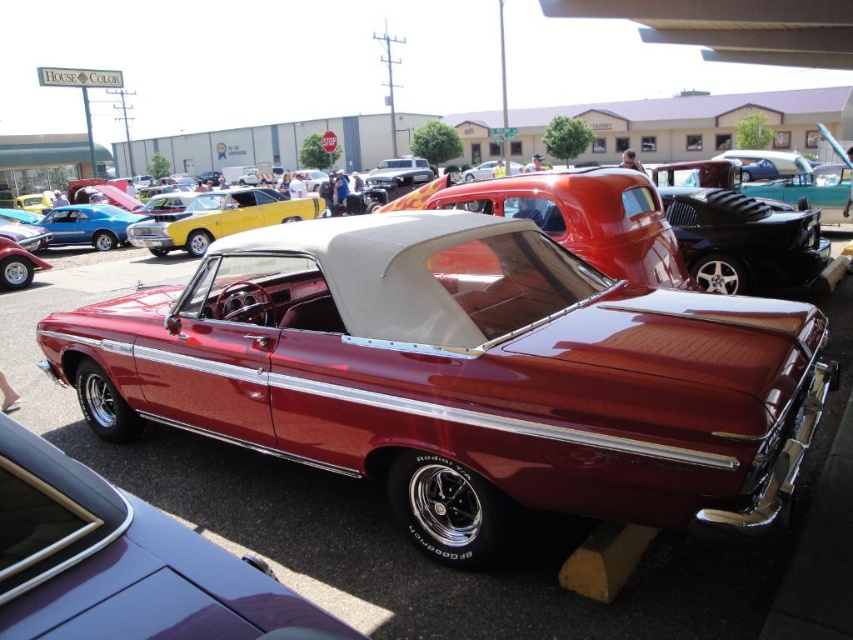
Who is positioned more to the left, shiny red car at center or shiny chrome car at center?

shiny chrome car at center

From the picture: Can you confirm if shiny red car at center is positioned to the left of shiny chrome car at center?

No, shiny red car at center is not to the left of shiny chrome car at center.

I want to click on shiny red car at center, so click(x=462, y=376).

Does shiny metallic yellow car at center have a lesser width compared to shiny chrome car at center?

Correct, shiny metallic yellow car at center's width is less than shiny chrome car at center's.

Who is shorter, shiny metallic yellow car at center or shiny chrome car at center?

shiny metallic yellow car at center is shorter.

This screenshot has height=640, width=853. Find the location of `shiny metallic yellow car at center`. shiny metallic yellow car at center is located at coordinates (219, 218).

Looking at this image, does shiny red car at center lie in front of shiny metallic yellow car at center?

Yes, it is.

Does point (695, 467) lie in front of point (235, 221)?

Yes, it is.

At what (x,y) coordinates should I click in order to perform the action: click on shiny red car at center. Please return your answer as a coordinate pair (x, y). The height and width of the screenshot is (640, 853). Looking at the image, I should click on (462, 376).